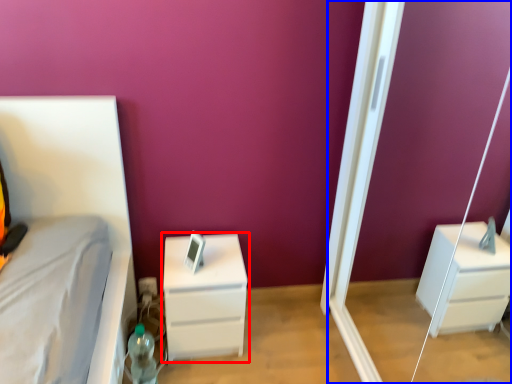
Question: Among these objects, which one is farthest to the camera, chest of drawers (highlighted by a red box) or screen door (highlighted by a blue box)?

Choices:
 (A) chest of drawers
 (B) screen door

Answer: (A)